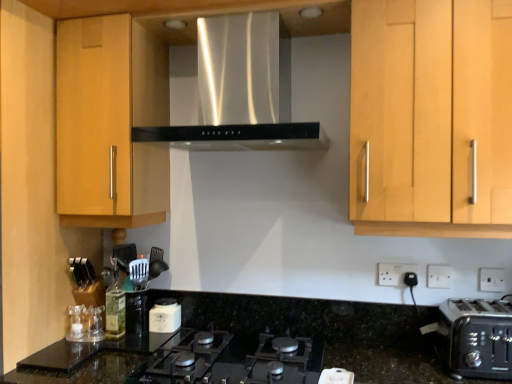
Question: Does white plastic electric outlet at lower right, arranged as the first electric outlet when viewed from the back, contain black plastic toaster at lower right?

Choices:
 (A) yes
 (B) no

Answer: (B)

Question: Is white plastic electric outlet at lower right, acting as the 1th electric outlet starting from the left, bigger than black plastic toaster at lower right?

Choices:
 (A) yes
 (B) no

Answer: (B)

Question: Does white plastic electric outlet at lower right, the 3th electric outlet in the front-to-back sequence, have a lesser height compared to black plastic toaster at lower right?

Choices:
 (A) yes
 (B) no

Answer: (A)

Question: From the image's perspective, is white plastic electric outlet at lower right, acting as the 1th electric outlet starting from the left, under black plastic toaster at lower right?

Choices:
 (A) no
 (B) yes

Answer: (A)

Question: Is the position of white plastic electric outlet at lower right, arranged as the first electric outlet when viewed from the back, less distant than that of black plastic toaster at lower right?

Choices:
 (A) yes
 (B) no

Answer: (B)

Question: Is white plastic electric outlet at lower right, arranged as the first electric outlet when viewed from the back, not within black plastic toaster at lower right?

Choices:
 (A) no
 (B) yes

Answer: (B)

Question: Can you confirm if white plastic electric outlet at lower right, which appears as the second electric outlet when viewed from the right, is smaller than black granite countertop at center?

Choices:
 (A) yes
 (B) no

Answer: (A)

Question: Would you say white plastic electric outlet at lower right, which ranks as the 2th electric outlet in back-to-front order, is outside black granite countertop at center?

Choices:
 (A) yes
 (B) no

Answer: (A)

Question: From the image's perspective, is white plastic electric outlet at lower right, which appears as the second electric outlet when viewed from the right, on black granite countertop at center?

Choices:
 (A) yes
 (B) no

Answer: (A)

Question: Can you confirm if white plastic electric outlet at lower right, which appears as the second electric outlet when viewed from the right, is positioned to the right of black granite countertop at center?

Choices:
 (A) yes
 (B) no

Answer: (A)

Question: From a real-world perspective, is white plastic electric outlet at lower right, which appears as the second electric outlet when viewed from the left, beneath black granite countertop at center?

Choices:
 (A) yes
 (B) no

Answer: (B)

Question: Can black granite countertop at center be found inside white plastic electric outlet at lower right, arranged as the second electric outlet when viewed from the front?

Choices:
 (A) no
 (B) yes

Answer: (A)

Question: From the image's perspective, would you say white matte jar at center is shown under white plastic toaster at lower right?

Choices:
 (A) yes
 (B) no

Answer: (B)